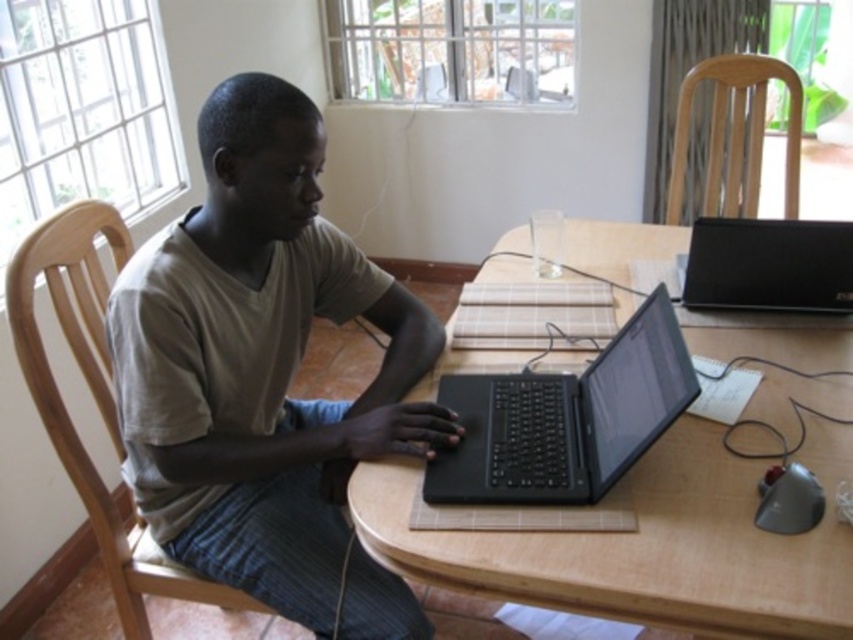
Question: Does light beige cotton shirt at center appear on the left side of black matte laptop at center?

Choices:
 (A) no
 (B) yes

Answer: (B)

Question: Does light beige cotton shirt at center appear over black plastic speaker at upper right?

Choices:
 (A) yes
 (B) no

Answer: (B)

Question: Which object appears farthest from the camera in this image?

Choices:
 (A) wooden table at center
 (B) light beige cotton shirt at center

Answer: (B)

Question: Which object is the farthest from the shiny black mouse at lower right?

Choices:
 (A) black plastic speaker at upper right
 (B) wooden table at center
 (C) black matte laptop at center
 (D) light beige cotton shirt at center

Answer: (D)

Question: Is wooden table at center further to camera compared to black plastic speaker at upper right?

Choices:
 (A) yes
 (B) no

Answer: (B)

Question: Which point appears farthest from the camera in this image?

Choices:
 (A) pyautogui.click(x=727, y=221)
 (B) pyautogui.click(x=167, y=490)
 (C) pyautogui.click(x=637, y=436)
 (D) pyautogui.click(x=781, y=508)

Answer: (A)